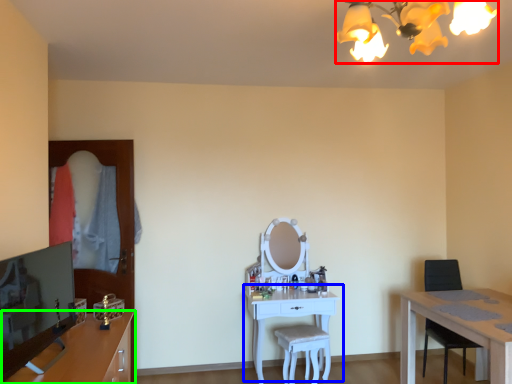
Question: Which is nearer to the light fixture (highlighted by a red box)? table (highlighted by a blue box) or cabinetry (highlighted by a green box).

Choices:
 (A) table
 (B) cabinetry

Answer: (B)